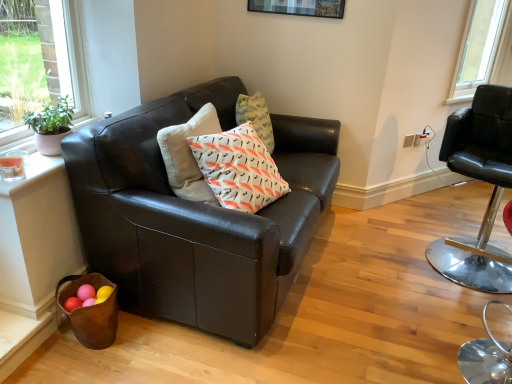
Question: Is black leather chair at right positioned behind matte black couch at center?

Choices:
 (A) no
 (B) yes

Answer: (B)

Question: Is the position of black leather chair at right less distant than that of matte black couch at center?

Choices:
 (A) yes
 (B) no

Answer: (B)

Question: Considering the relative positions of black leather chair at right and matte black couch at center in the image provided, is black leather chair at right to the left of matte black couch at center from the viewer's perspective?

Choices:
 (A) no
 (B) yes

Answer: (A)

Question: Can you confirm if black leather chair at right is smaller than matte black couch at center?

Choices:
 (A) no
 (B) yes

Answer: (B)

Question: Is black leather chair at right not near matte black couch at center?

Choices:
 (A) yes
 (B) no

Answer: (A)

Question: Is black leather chair at right wider than matte black couch at center?

Choices:
 (A) no
 (B) yes

Answer: (A)

Question: Considering the relative sizes of matte black couch at center and black leather chair at right in the image provided, is matte black couch at center bigger than black leather chair at right?

Choices:
 (A) no
 (B) yes

Answer: (B)

Question: From a real-world perspective, does matte black couch at center stand above black leather chair at right?

Choices:
 (A) no
 (B) yes

Answer: (A)

Question: Can you confirm if matte black couch at center is smaller than black leather chair at right?

Choices:
 (A) no
 (B) yes

Answer: (A)

Question: Can you confirm if matte black couch at center is taller than black leather chair at right?

Choices:
 (A) no
 (B) yes

Answer: (A)

Question: Can you confirm if matte black couch at center is shorter than black leather chair at right?

Choices:
 (A) yes
 (B) no

Answer: (A)

Question: Is matte black couch at center next to black leather chair at right and touching it?

Choices:
 (A) yes
 (B) no

Answer: (B)

Question: Is black leather chair at right in front of or behind matte black couch at center in the image?

Choices:
 (A) front
 (B) behind

Answer: (B)